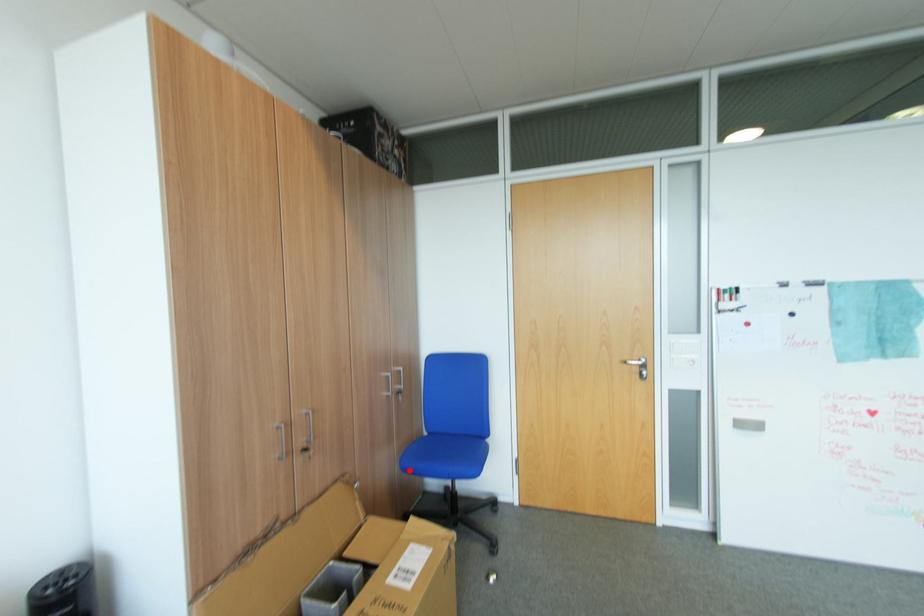
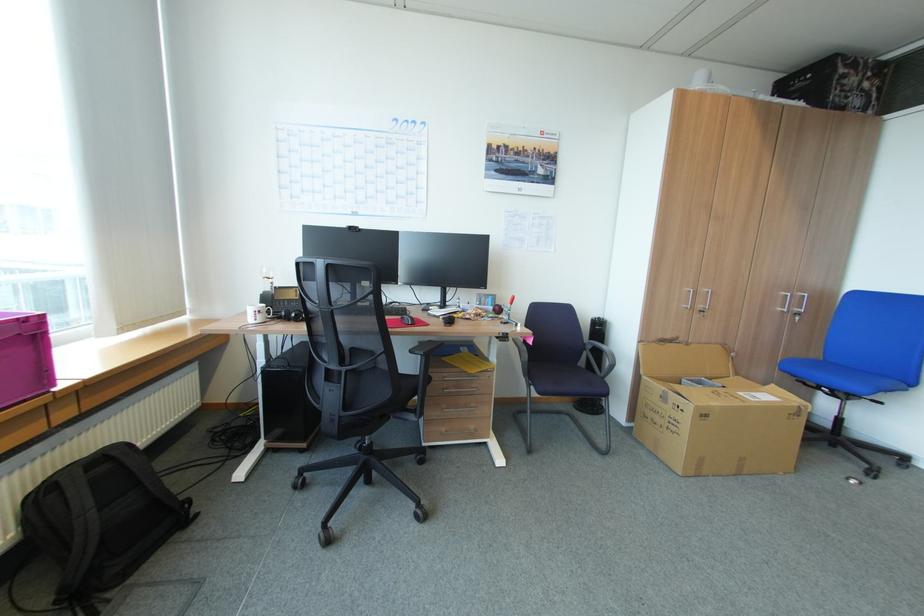
Question: I am providing you with two images of the same scene from different viewpoints. Given a red point in image1, look at the same physical point in image2. Is it:

Choices:
 (A) Closer to the viewpoint
 (B) Farther from the viewpoint

Answer: (A)